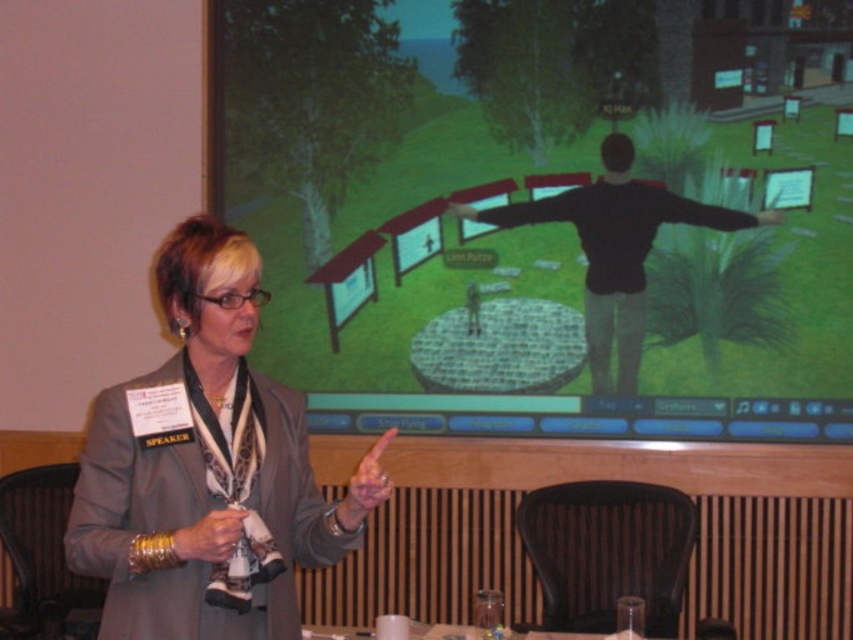
Does gray fabric jacket at center have a smaller size compared to black matte shirt at center?

Incorrect, gray fabric jacket at center is not smaller in size than black matte shirt at center.

In the scene shown: Does gray fabric jacket at center have a greater width compared to black matte shirt at center?

Incorrect, gray fabric jacket at center's width does not surpass black matte shirt at center's.

Between point (250, 300) and point (705, 220), which one is positioned behind?

Positioned behind is point (705, 220).

This screenshot has height=640, width=853. I want to click on gray fabric jacket at center, so click(x=207, y=468).

Between matte black projection screen at upper center and gray fabric jacket at center, which one has more height?

matte black projection screen at upper center is taller.

Does point (660, 403) come farther from viewer compared to point (306, 440)?

That is True.

This screenshot has width=853, height=640. I want to click on matte black projection screen at upper center, so click(x=547, y=211).

Find the location of a particular element. The height and width of the screenshot is (640, 853). matte black projection screen at upper center is located at coordinates (547, 211).

Is point (712, 435) positioned after point (560, 208)?

No, (712, 435) is closer to viewer.

Is point (558, 88) in front of point (680, 211)?

No, (558, 88) is further to viewer.

Where is `matte black projection screen at upper center`? This screenshot has width=853, height=640. matte black projection screen at upper center is located at coordinates (547, 211).